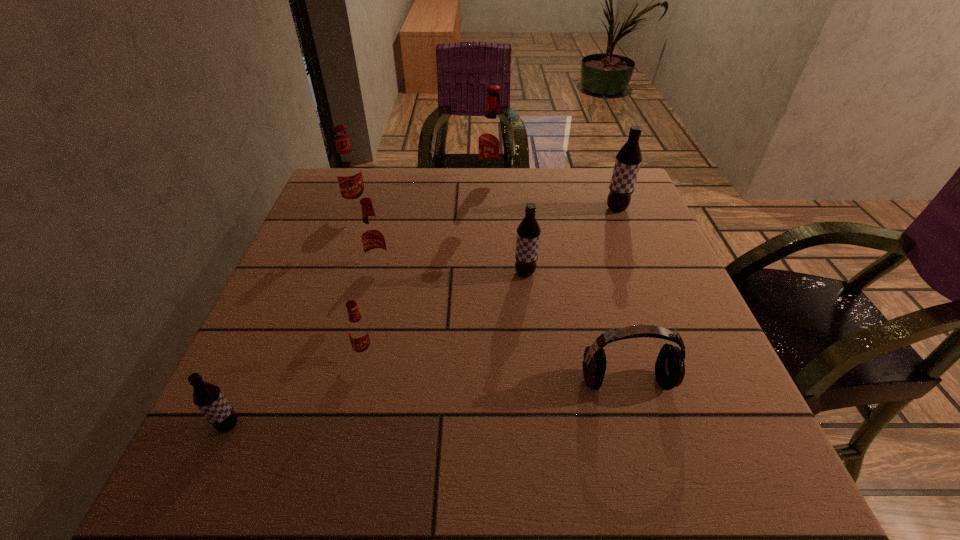
Find the location of a particular element. This screenshot has width=960, height=540. vacant space located on the back of the third nearest object is located at coordinates (392, 241).

In order to click on free space located 0.070m on the back of the leftmost root beer in this screenshot , I will do `click(250, 379)`.

At what (x,y) coordinates should I click in order to perform the action: click on root beer that is at the right edge. Please return your answer as a coordinate pair (x, y). This screenshot has width=960, height=540. Looking at the image, I should click on (628, 159).

Image resolution: width=960 pixels, height=540 pixels. In order to click on headset at the right edge in this screenshot , I will do `click(670, 367)`.

Where is `object at the far left corner`? Image resolution: width=960 pixels, height=540 pixels. object at the far left corner is located at coordinates pyautogui.click(x=348, y=170).

Where is `object situated at the far right corner`? The image size is (960, 540). object situated at the far right corner is located at coordinates (628, 159).

Image resolution: width=960 pixels, height=540 pixels. What are the coordinates of `vacant area at the far edge` in the screenshot? It's located at (577, 186).

In the image, there is a desktop. What are the coordinates of `vacant space at the left edge` in the screenshot? It's located at (339, 226).

In order to click on free space at the right edge of the desktop in this screenshot , I will do `click(653, 260)`.

I want to click on free space at the far left corner of the desktop, so click(x=342, y=206).